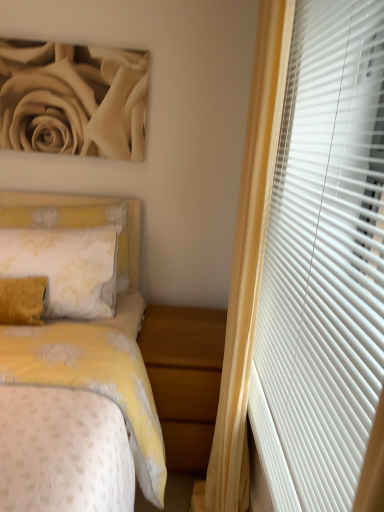
Image resolution: width=384 pixels, height=512 pixels. I want to click on yellow fabric headboard at left, so click(x=78, y=219).

Describe the element at coordinates (78, 219) in the screenshot. The height and width of the screenshot is (512, 384). I see `yellow fabric headboard at left` at that location.

You are a GUI agent. You are given a task and a screenshot of the screen. Output one action in this format:
    pyautogui.click(x=<x>, y=<y>)
    Task: Click on the wooden nightstand at lower center
    This screenshot has height=512, width=384.
    Given the screenshot: What is the action you would take?
    pyautogui.click(x=184, y=378)

Describe the element at coordinates (310, 270) in the screenshot. I see `white matte blinds at right` at that location.

Where is `yellow fabric headboard at left`? This screenshot has width=384, height=512. yellow fabric headboard at left is located at coordinates [78, 219].

Find the location of a particular element. This screenshot has width=384, height=512. curtain lying below the yellow fabric headboard at left (from the image's perspective) is located at coordinates (310, 270).

Which is nearer, [134,266] or [307,452]?

Point [134,266].

Can you confirm if yellow fabric headboard at left is shorter than white matte blinds at right?

Yes.

Looking at this image, considering the sizes of yellow fabric headboard at left and white matte blinds at right in the image, is yellow fabric headboard at left wider or thinner than white matte blinds at right?

Clearly, yellow fabric headboard at left has more width compared to white matte blinds at right.

Considering the sizes of objects wooden nightstand at lower center and white matte blinds at right in the image provided, who is bigger, wooden nightstand at lower center or white matte blinds at right?

Bigger between the two is wooden nightstand at lower center.

Consider the image. Considering the positions of objects wooden nightstand at lower center and white matte blinds at right in the image provided, who is more to the right, wooden nightstand at lower center or white matte blinds at right?

From the viewer's perspective, white matte blinds at right appears more on the right side.

Measure the distance between wooden nightstand at lower center and white matte blinds at right.

They are 19.65 inches apart.

Is wooden nightstand at lower center wider than white matte blinds at right?

Yes, wooden nightstand at lower center is wider than white matte blinds at right.

Is yellow fabric headboard at left positioned behind wooden nightstand at lower center?

Yes, it is.

Measure the distance from yellow fabric headboard at left to wooden nightstand at lower center.

yellow fabric headboard at left and wooden nightstand at lower center are 56.25 centimeters apart from each other.

Which is more to the left, yellow fabric headboard at left or wooden nightstand at lower center?

Positioned to the left is yellow fabric headboard at left.

Does yellow fabric headboard at left have a smaller size compared to wooden nightstand at lower center?

Indeed, yellow fabric headboard at left has a smaller size compared to wooden nightstand at lower center.

Can you tell me how much wooden nightstand at lower center and yellow fabric headboard at left differ in facing direction?

3.03 degrees separate the facing orientations of wooden nightstand at lower center and yellow fabric headboard at left.

Is wooden nightstand at lower center bigger or smaller than yellow fabric headboard at left?

wooden nightstand at lower center is bigger than yellow fabric headboard at left.

From a real-world perspective, is wooden nightstand at lower center located higher than yellow fabric headboard at left?

No, from a real-world perspective, wooden nightstand at lower center is not over yellow fabric headboard at left

Looking at this image, is wooden nightstand at lower center next to yellow fabric headboard at left?

No, wooden nightstand at lower center is not making contact with yellow fabric headboard at left.

Based on the photo, from a real-world perspective, between white matte blinds at right and yellow fabric headboard at left, who is vertically lower?

yellow fabric headboard at left, from a real-world perspective.

The height and width of the screenshot is (512, 384). I want to click on headboard that appears above the white matte blinds at right (from the image's perspective), so click(x=78, y=219).

Between white matte blinds at right and yellow fabric headboard at left, which one has larger width?

Wider between the two is yellow fabric headboard at left.

Would you say white matte blinds at right is to the left or to the right of wooden nightstand at lower center in the picture?

In the image, white matte blinds at right appears on the right side of wooden nightstand at lower center.

Where is `curtain in front of the wooden nightstand at lower center`? This screenshot has height=512, width=384. curtain in front of the wooden nightstand at lower center is located at coordinates (x=310, y=270).

Which object is more forward, white matte blinds at right or wooden nightstand at lower center?

white matte blinds at right is more forward.

Locate an element on the screen. headboard below the white matte blinds at right (from a real-world perspective) is located at coordinates (78, 219).

Find the location of a particular element. The image size is (384, 512). curtain above the wooden nightstand at lower center (from the image's perspective) is located at coordinates (310, 270).

Based on their spatial positions, is yellow fabric headboard at left or white matte blinds at right closer to wooden nightstand at lower center?

white matte blinds at right.

From the image, which object appears to be nearer to wooden nightstand at lower center, white matte blinds at right or yellow fabric headboard at left?

white matte blinds at right.

Estimate the real-world distances between objects in this image. Which object is closer to yellow fabric headboard at left, white matte blinds at right or wooden nightstand at lower center?

wooden nightstand at lower center.

In the scene shown: From the image, which object appears to be farther from white matte blinds at right, wooden nightstand at lower center or yellow fabric headboard at left?

Based on the image, yellow fabric headboard at left appears to be further to white matte blinds at right.

When comparing their distances from white matte blinds at right, does yellow fabric headboard at left or wooden nightstand at lower center seem closer?

Among the two, wooden nightstand at lower center is located nearer to white matte blinds at right.

From the image, which object appears to be farther from yellow fabric headboard at left, wooden nightstand at lower center or white matte blinds at right?

white matte blinds at right.

Locate an element on the screen. This screenshot has height=512, width=384. nightstand between white matte blinds at right and yellow fabric headboard at left in the front-back direction is located at coordinates (184, 378).